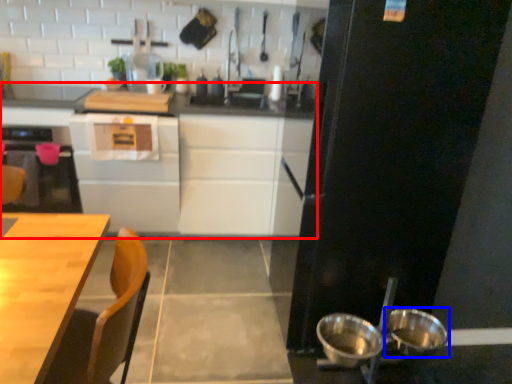
Question: Which object is closer to the camera taking this photo, cabinetry (highlighted by a red box) or bowl (highlighted by a blue box)?

Choices:
 (A) cabinetry
 (B) bowl

Answer: (B)